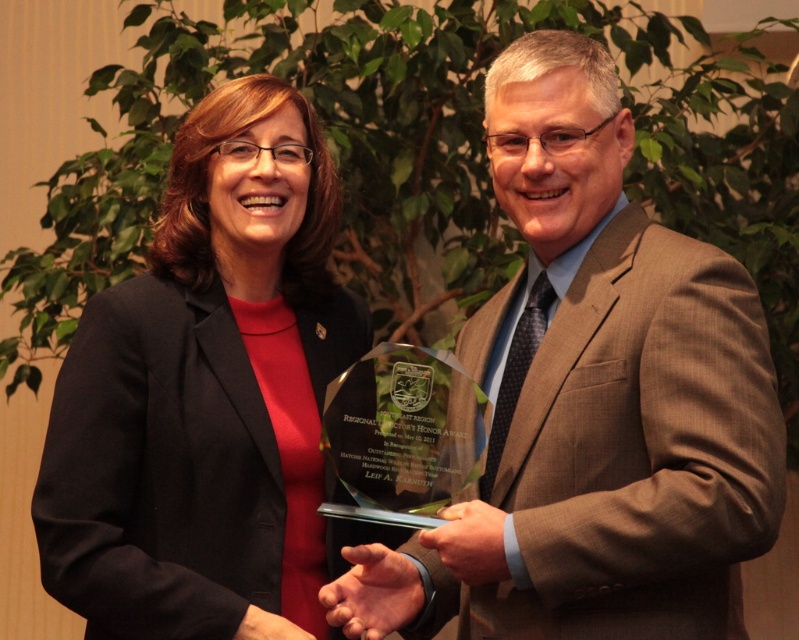
Between brown textured suit at center and matte black blazer at center, which one appears on the left side from the viewer's perspective?

Positioned to the left is matte black blazer at center.

Can you confirm if brown textured suit at center is thinner than matte black blazer at center?

In fact, brown textured suit at center might be wider than matte black blazer at center.

Who is more distant from viewer, [768,534] or [146,333]?

The point [146,333] is more distant.

Locate an element on the screen. This screenshot has height=640, width=799. brown textured suit at center is located at coordinates (591, 401).